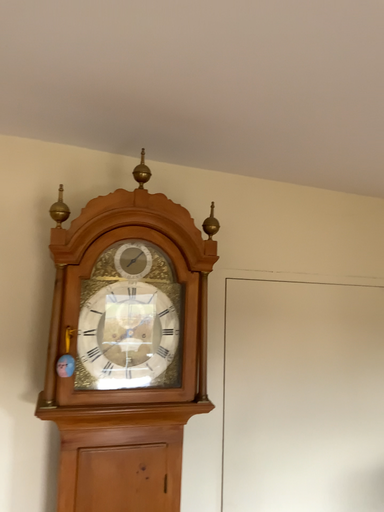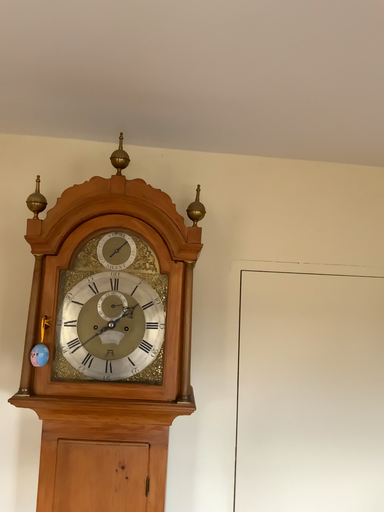
Question: How did the camera likely rotate when shooting the video?

Choices:
 (A) rotated left
 (B) rotated right

Answer: (A)